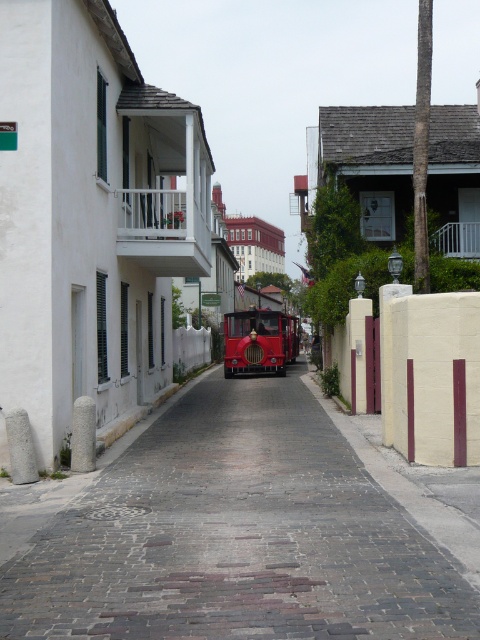
Who is positioned more to the right, smooth cobblestone alley at center or shiny red trolley at center?

shiny red trolley at center

How distant is smooth cobblestone alley at center from shiny red trolley at center?

A distance of 58.91 feet exists between smooth cobblestone alley at center and shiny red trolley at center.

Where is `smooth cobblestone alley at center`? The height and width of the screenshot is (640, 480). smooth cobblestone alley at center is located at coordinates (242, 529).

Where is `smooth cobblestone alley at center`? smooth cobblestone alley at center is located at coordinates click(242, 529).